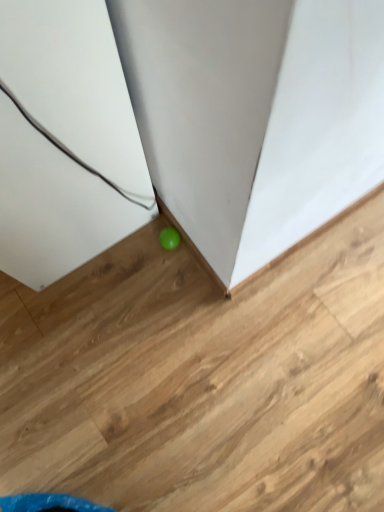
This screenshot has height=512, width=384. What do you see at coordinates (201, 379) in the screenshot?
I see `green rubber ball at lower center` at bounding box center [201, 379].

Looking at this image, measure the distance between point (292, 471) and camera.

39.17 inches.

Locate an element on the screen. This screenshot has width=384, height=512. green rubber ball at lower center is located at coordinates (201, 379).

What are the coordinates of `green rubber ball at lower center` in the screenshot? It's located at (201, 379).